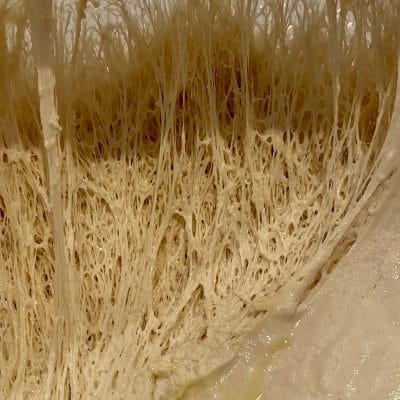
You are a GUI agent. You are given a task and a screenshot of the screen. Output one action in this format:
    pyautogui.click(x=<x>, y=<y>)
    Task: Click on the lit area
    The height and width of the screenshot is (400, 400).
    Given the screenshot: What is the action you would take?
    pyautogui.click(x=209, y=257)